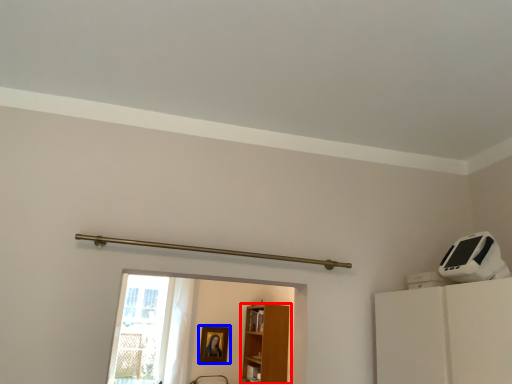
Question: Which of the following is the closest to the observer, furniture (highlighted by a red box) or picture frame (highlighted by a blue box)?

Choices:
 (A) furniture
 (B) picture frame

Answer: (A)